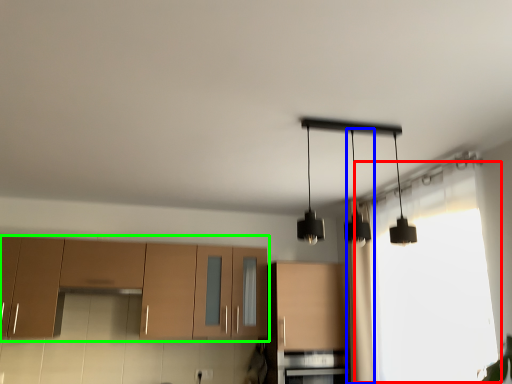
Question: Based on their relative distances, which object is farther from window (highlighted by a red box)? Choose from curtain (highlighted by a blue box) and cabinetry (highlighted by a green box).

Choices:
 (A) curtain
 (B) cabinetry

Answer: (B)